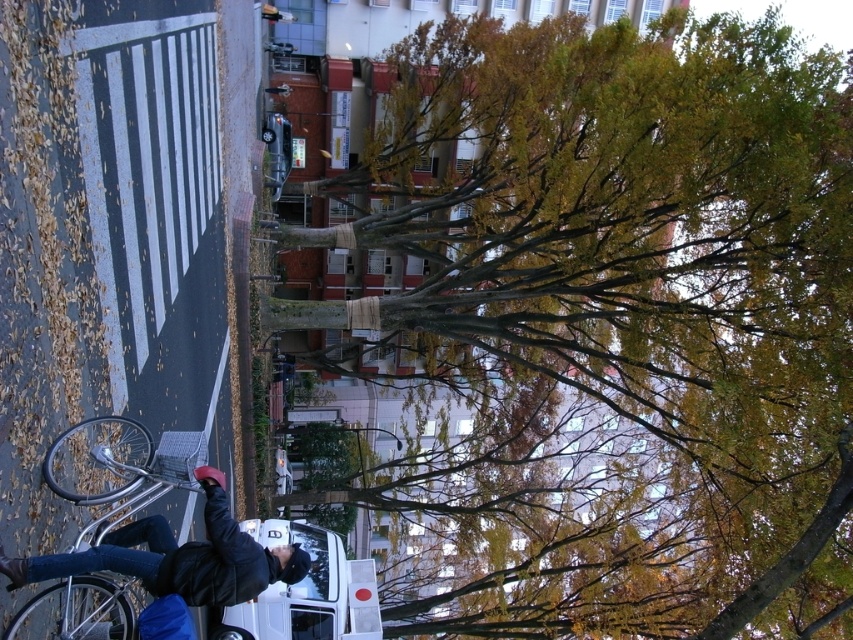
Does point (676, 621) lie behind point (100, 502)?

Yes, it is behind point (100, 502).

Which is more to the right, green leafy tree at upper center or silver metallic bicycle at lower left?

green leafy tree at upper center

Measure the distance between green leafy tree at upper center and camera.

The distance of green leafy tree at upper center from camera is 43.42 meters.

Identify the location of green leafy tree at upper center. (624, 305).

Can you confirm if green leafy tree at upper center is bigger than white matte van at center?

Yes, green leafy tree at upper center is bigger than white matte van at center.

Can you confirm if green leafy tree at upper center is positioned below white matte van at center?

Actually, green leafy tree at upper center is above white matte van at center.

Is point (459, 621) farther from viewer compared to point (235, 611)?

That is True.

Where is `green leafy tree at upper center`? The image size is (853, 640). green leafy tree at upper center is located at coordinates [624, 305].

Does silver metallic bicycle at lower left have a smaller size compared to white matte van at center?

Correct, silver metallic bicycle at lower left occupies less space than white matte van at center.

Does silver metallic bicycle at lower left have a lesser width compared to white matte van at center?

Yes, silver metallic bicycle at lower left is thinner than white matte van at center.

Is point (80, 602) positioned in front of point (326, 589)?

That is True.

Locate an element on the screen. The height and width of the screenshot is (640, 853). silver metallic bicycle at lower left is located at coordinates (119, 468).